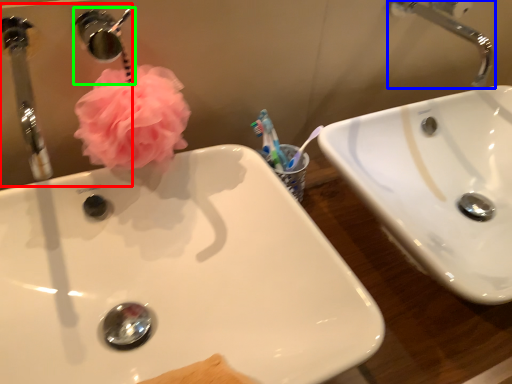
Question: Estimate the real-world distances between objects in this image. Which object is closer to mirror (highlighted by a red box), tap (highlighted by a blue box) or plumbing fixture (highlighted by a green box)?

Choices:
 (A) tap
 (B) plumbing fixture

Answer: (A)